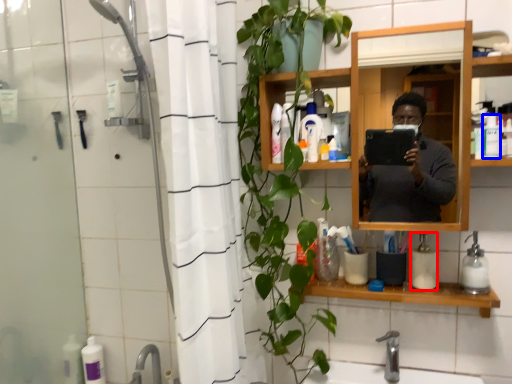
Question: Which object is closer to the camera taking this photo, soap dispenser (highlighted by a red box) or toiletry (highlighted by a blue box)?

Choices:
 (A) soap dispenser
 (B) toiletry

Answer: (B)